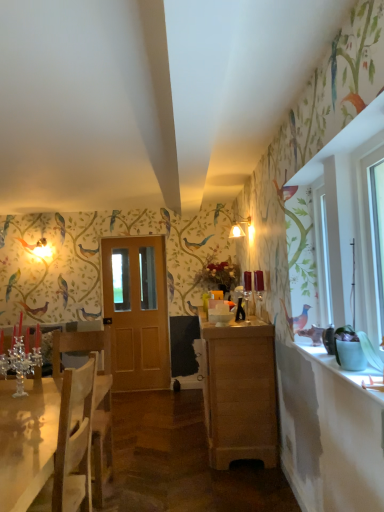
Question: Is light brown wood cabinet at center further to the viewer compared to matte white lampshade at center?

Choices:
 (A) no
 (B) yes

Answer: (A)

Question: Is light brown wood cabinet at center bigger than matte white lampshade at center?

Choices:
 (A) no
 (B) yes

Answer: (B)

Question: Is light brown wood cabinet at center to the left of matte white lampshade at center from the viewer's perspective?

Choices:
 (A) yes
 (B) no

Answer: (A)

Question: From a real-world perspective, is light brown wood cabinet at center under matte white lampshade at center?

Choices:
 (A) yes
 (B) no

Answer: (A)

Question: Considering the relative sizes of light brown wood cabinet at center and matte white lampshade at center in the image provided, is light brown wood cabinet at center taller than matte white lampshade at center?

Choices:
 (A) yes
 (B) no

Answer: (A)

Question: Looking at their shapes, would you say light brown wood cabinet at center is wider or thinner than white glossy counter top at right?

Choices:
 (A) wide
 (B) thin

Answer: (A)

Question: From a real-world perspective, relative to white glossy counter top at right, is light brown wood cabinet at center vertically above or below?

Choices:
 (A) below
 (B) above

Answer: (A)

Question: From their relative heights in the image, would you say light brown wood cabinet at center is taller or shorter than white glossy counter top at right?

Choices:
 (A) short
 (B) tall

Answer: (B)

Question: Does point (246, 380) appear closer or farther from the camera than point (306, 347)?

Choices:
 (A) closer
 (B) farther

Answer: (B)

Question: Is point (364, 362) closer or farther from the camera than point (139, 266)?

Choices:
 (A) closer
 (B) farther

Answer: (A)

Question: Would you say green matte pot at right is to the left or to the right of light brown wooden door at center in the picture?

Choices:
 (A) left
 (B) right

Answer: (B)

Question: Considering the positions of green matte pot at right and light brown wooden door at center in the image, is green matte pot at right bigger or smaller than light brown wooden door at center?

Choices:
 (A) big
 (B) small

Answer: (B)

Question: From the image's perspective, relative to light brown wooden door at center, is green matte pot at right above or below?

Choices:
 (A) above
 (B) below

Answer: (A)

Question: In terms of size, does light brown wood cabinet at center appear bigger or smaller than white glass window at right?

Choices:
 (A) big
 (B) small

Answer: (A)

Question: From the image's perspective, relative to white glass window at right, is light brown wood cabinet at center above or below?

Choices:
 (A) below
 (B) above

Answer: (A)